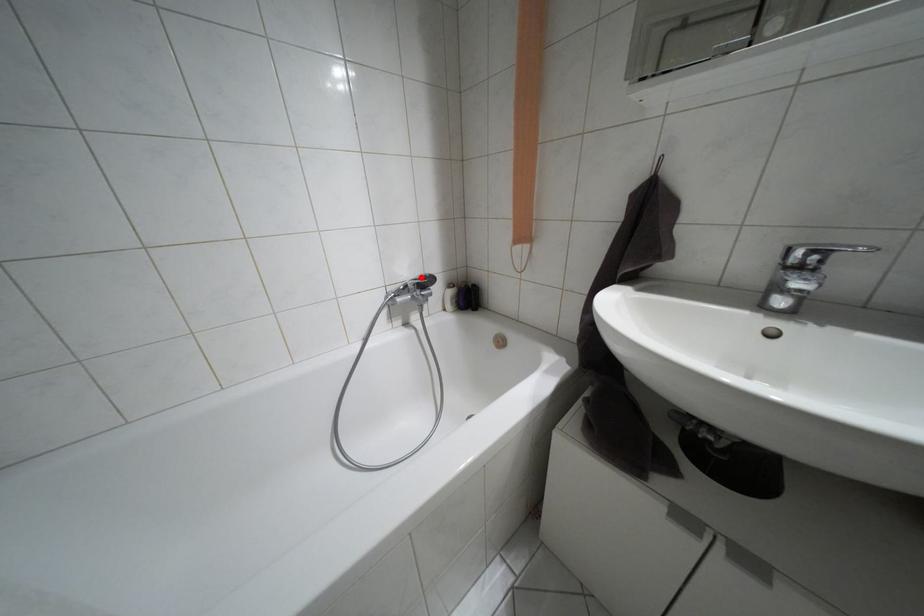
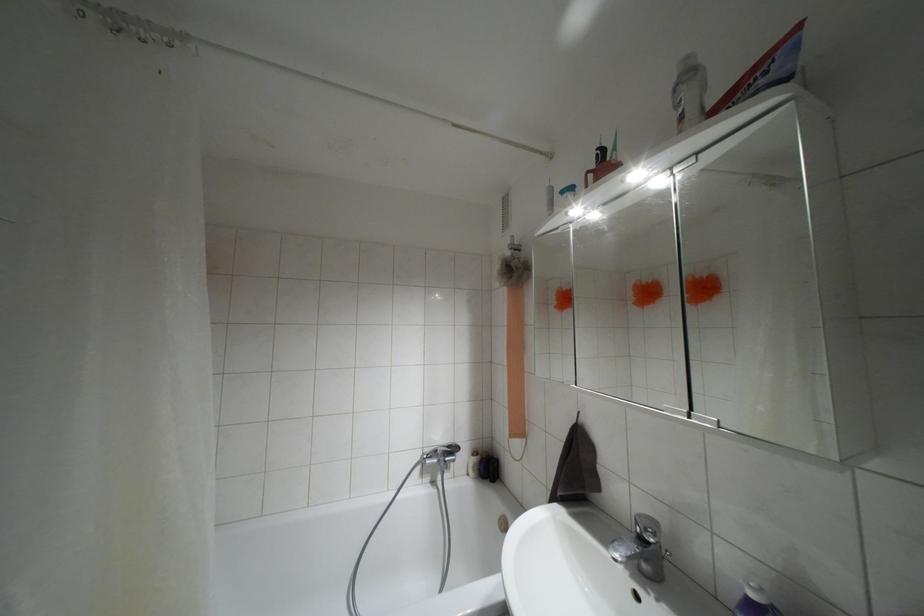
Locate, in the second image, the point that corresponds to the highlighted location in the first image.

(447, 446)